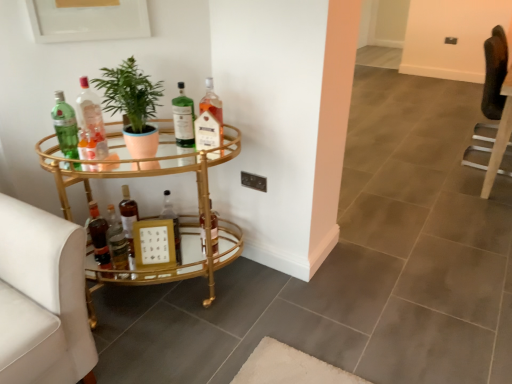
Question: In which direction should I rotate to look at translucent glass bottle at center, acting as the 9th bottle starting from the left?

Choices:
 (A) right
 (B) left

Answer: (B)

Question: Can you confirm if gold metallic swivel chair at left, placed as the 2th swivel chair when sorted from back to front, is positioned to the left of matte brown bottle at lower left, the 5th bottle when ordered from right to left?

Choices:
 (A) yes
 (B) no

Answer: (A)

Question: Is gold metallic swivel chair at left, the second swivel chair in the right-to-left sequence, shorter than matte brown bottle at lower left, the 5th bottle when ordered from right to left?

Choices:
 (A) no
 (B) yes

Answer: (A)

Question: From the image's perspective, would you say gold metallic swivel chair at left, placed as the 2th swivel chair when sorted from back to front, is positioned over matte brown bottle at lower left, the 5th bottle when ordered from right to left?

Choices:
 (A) yes
 (B) no

Answer: (B)

Question: From the image's perspective, would you say gold metallic swivel chair at left, the second swivel chair in the right-to-left sequence, is shown under matte brown bottle at lower left, the 5th bottle when ordered from right to left?

Choices:
 (A) yes
 (B) no

Answer: (A)

Question: Is gold metallic swivel chair at left, positioned as the 1th swivel chair in front-to-back order, located outside matte brown bottle at lower left, the 6th bottle viewed from the left?

Choices:
 (A) yes
 (B) no

Answer: (A)

Question: Can you confirm if gold metallic swivel chair at left, positioned as the 1th swivel chair in front-to-back order, is smaller than matte brown bottle at lower left, the 5th bottle when ordered from right to left?

Choices:
 (A) no
 (B) yes

Answer: (A)

Question: Considering the relative positions of green glass bottle at center, arranged as the eighth bottle when viewed from the left, and gold mirrored bar cart at left in the image provided, is green glass bottle at center, arranged as the eighth bottle when viewed from the left, to the right of gold mirrored bar cart at left from the viewer's perspective?

Choices:
 (A) yes
 (B) no

Answer: (A)

Question: Is green glass bottle at center, arranged as the eighth bottle when viewed from the left, to the left of gold mirrored bar cart at left from the viewer's perspective?

Choices:
 (A) yes
 (B) no

Answer: (B)

Question: Is green glass bottle at center, the 3th bottle in the right-to-left sequence, directly adjacent to gold mirrored bar cart at left?

Choices:
 (A) yes
 (B) no

Answer: (B)

Question: Is green glass bottle at center, arranged as the eighth bottle when viewed from the left, facing towards gold mirrored bar cart at left?

Choices:
 (A) yes
 (B) no

Answer: (B)

Question: From a real-world perspective, is green glass bottle at center, arranged as the eighth bottle when viewed from the left, located beneath gold mirrored bar cart at left?

Choices:
 (A) no
 (B) yes

Answer: (A)

Question: Is green glass bottle at center, the 3th bottle in the right-to-left sequence, not near gold mirrored bar cart at left?

Choices:
 (A) no
 (B) yes

Answer: (A)

Question: Considering the relative sizes of shiny brown bottle at lower left, the second bottle when ordered from left to right, and green glass bottle at center, the 3th bottle in the right-to-left sequence, in the image provided, is shiny brown bottle at lower left, the second bottle when ordered from left to right, bigger than green glass bottle at center, the 3th bottle in the right-to-left sequence,?

Choices:
 (A) no
 (B) yes

Answer: (A)